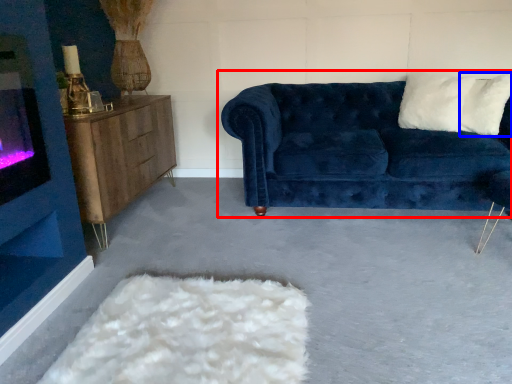
Question: Among these objects, which one is nearest to the camera, studio couch (highlighted by a red box) or pillow (highlighted by a blue box)?

Choices:
 (A) studio couch
 (B) pillow

Answer: (A)